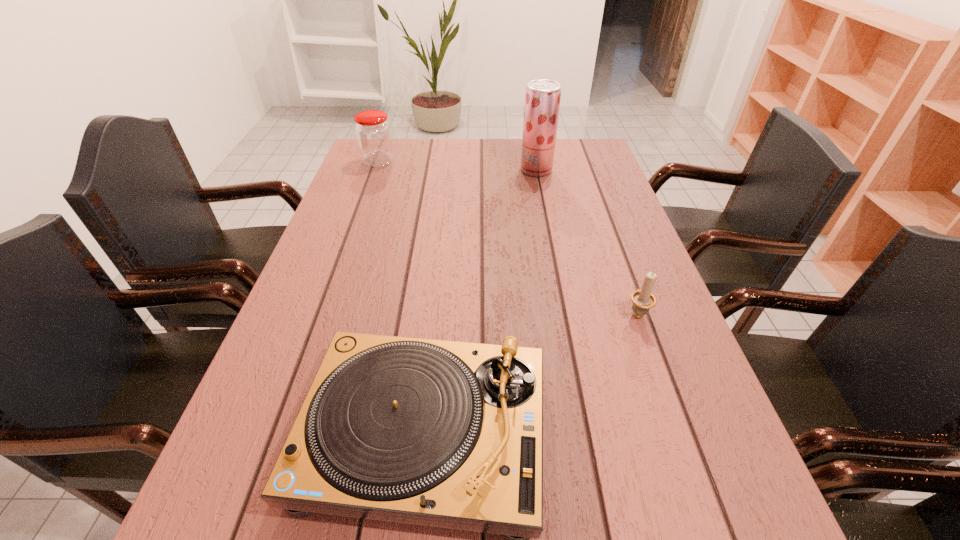
This screenshot has height=540, width=960. I want to click on the tallest object, so tap(542, 100).

Where is `the third object from left to right`? Image resolution: width=960 pixels, height=540 pixels. the third object from left to right is located at coordinates (542, 100).

In order to click on jar in this screenshot , I will do `click(373, 133)`.

At what (x,y) coordinates should I click in order to perform the action: click on candle_holder. Please return your answer as a coordinate pair (x, y). The width and height of the screenshot is (960, 540). Looking at the image, I should click on (643, 300).

Find the location of `the rightmost object`. the rightmost object is located at coordinates (643, 300).

Locate an element on the screen. vacant space located on the right of the third object from left to right is located at coordinates (604, 170).

This screenshot has width=960, height=540. What are the coordinates of `blank area located on the front of the jar` in the screenshot? It's located at (360, 211).

I want to click on vacant space located on the handle side of the third farthest object, so click(x=614, y=249).

Where is `vacant space situated on the handle side of the third farthest object`? Image resolution: width=960 pixels, height=540 pixels. vacant space situated on the handle side of the third farthest object is located at coordinates (609, 233).

This screenshot has height=540, width=960. Identify the location of vacant space located 0.110m on the handle side of the third farthest object. (622, 269).